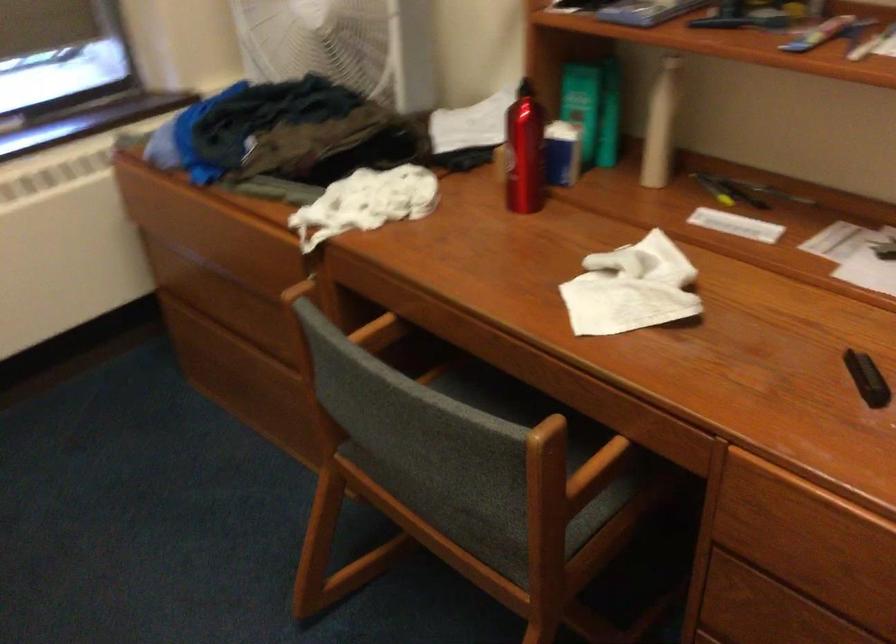
The location [659,125] corresponds to which object?

It refers to a white plastic bottle.